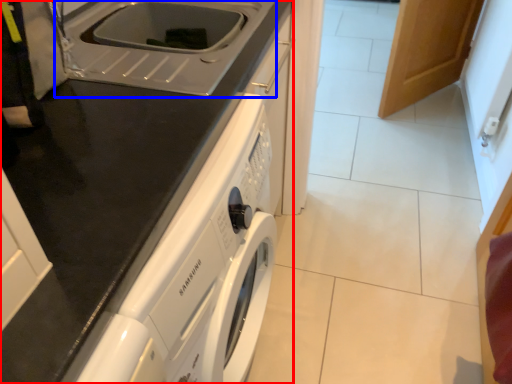
Question: Which point is closer to the camera, home appliance (highlighted by a red box) or sink (highlighted by a blue box)?

Choices:
 (A) home appliance
 (B) sink

Answer: (A)